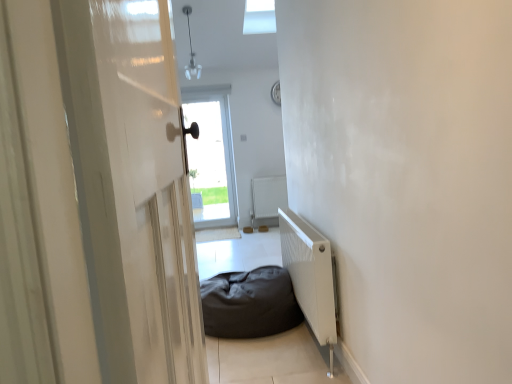
Question: Is white matte radiator at center, which ranks as the second radiator in front-to-back order, facing away from white glossy door at left?

Choices:
 (A) yes
 (B) no

Answer: (B)

Question: From a real-world perspective, is white matte radiator at center, which ranks as the second radiator in front-to-back order, located higher than white glossy door at left?

Choices:
 (A) yes
 (B) no

Answer: (B)

Question: From a real-world perspective, is white matte radiator at center, the 1th radiator in the back-to-front sequence, below white glossy door at left?

Choices:
 (A) yes
 (B) no

Answer: (A)

Question: Can you confirm if white matte radiator at center, the 1th radiator in the back-to-front sequence, is smaller than white glossy door at left?

Choices:
 (A) no
 (B) yes

Answer: (B)

Question: Does white matte radiator at center, the 1th radiator in the back-to-front sequence, lie in front of white glossy door at left?

Choices:
 (A) no
 (B) yes

Answer: (A)

Question: Considering the relative sizes of white matte radiator at center, which ranks as the second radiator in front-to-back order, and white glossy door at left in the image provided, is white matte radiator at center, which ranks as the second radiator in front-to-back order, thinner than white glossy door at left?

Choices:
 (A) no
 (B) yes

Answer: (B)

Question: From the image's perspective, would you say transparent glass door at center is shown under white matte radiator at center, the 1th radiator in the back-to-front sequence?

Choices:
 (A) no
 (B) yes

Answer: (A)

Question: From the image's perspective, is transparent glass door at center located above white matte radiator at center, the 1th radiator in the back-to-front sequence?

Choices:
 (A) yes
 (B) no

Answer: (A)

Question: Considering the relative sizes of transparent glass door at center and white matte radiator at center, the 1th radiator in the back-to-front sequence, in the image provided, is transparent glass door at center wider than white matte radiator at center, the 1th radiator in the back-to-front sequence,?

Choices:
 (A) yes
 (B) no

Answer: (A)

Question: Considering the relative sizes of transparent glass door at center and white matte radiator at center, which ranks as the second radiator in front-to-back order, in the image provided, is transparent glass door at center shorter than white matte radiator at center, which ranks as the second radiator in front-to-back order,?

Choices:
 (A) no
 (B) yes

Answer: (A)

Question: Would you say transparent glass door at center is a long distance from white matte radiator at center, the 1th radiator in the back-to-front sequence?

Choices:
 (A) yes
 (B) no

Answer: (B)

Question: From a real-world perspective, is transparent glass door at center beneath white matte radiator at center, the 1th radiator in the back-to-front sequence?

Choices:
 (A) no
 (B) yes

Answer: (A)

Question: From a real-world perspective, is dark fabric bean bag at center below white matte radiator at center, the 1th radiator in the back-to-front sequence?

Choices:
 (A) yes
 (B) no

Answer: (A)